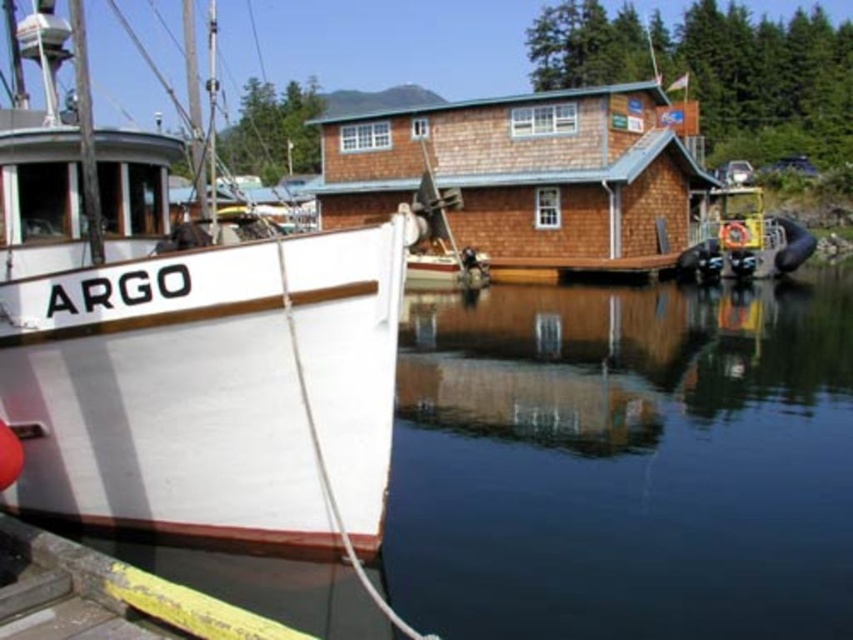
Is white matte boat at left positioned in front of brown shingle cabin at center?

Yes, white matte boat at left is closer to the viewer.

Between point (70, 403) and point (517, 154), which one is positioned in front?

Point (70, 403)

Which is behind, point (373, 330) or point (438, 182)?

Point (438, 182)

Where is `white matte boat at left`? The height and width of the screenshot is (640, 853). white matte boat at left is located at coordinates (187, 355).

Who is positioned more to the right, clear water at lower left or brown shingle cabin at center?

Positioned to the right is clear water at lower left.

Which is behind, point (627, 532) or point (374, 116)?

The point (374, 116) is more distant.

Find the location of a particular element. This screenshot has height=640, width=853. clear water at lower left is located at coordinates (625, 461).

Between clear water at lower left and white matte boat at left, which one has less height?

white matte boat at left

Is point (747, 497) closer to viewer compared to point (177, 340)?

No, it is behind (177, 340).

This screenshot has width=853, height=640. What do you see at coordinates (625, 461) in the screenshot?
I see `clear water at lower left` at bounding box center [625, 461].

The image size is (853, 640). What are the coordinates of `clear water at lower left` in the screenshot? It's located at (625, 461).